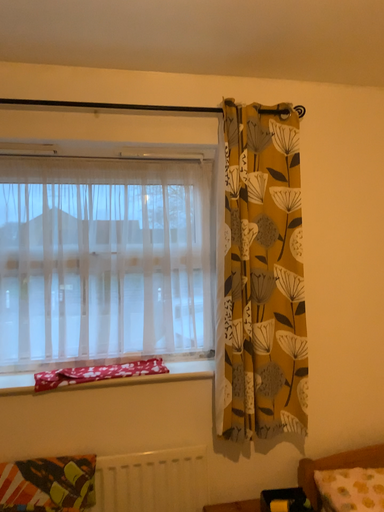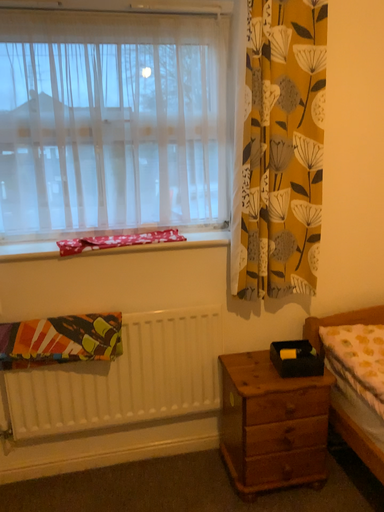
Question: Which way did the camera rotate in the video?

Choices:
 (A) rotated downward
 (B) rotated upward

Answer: (A)